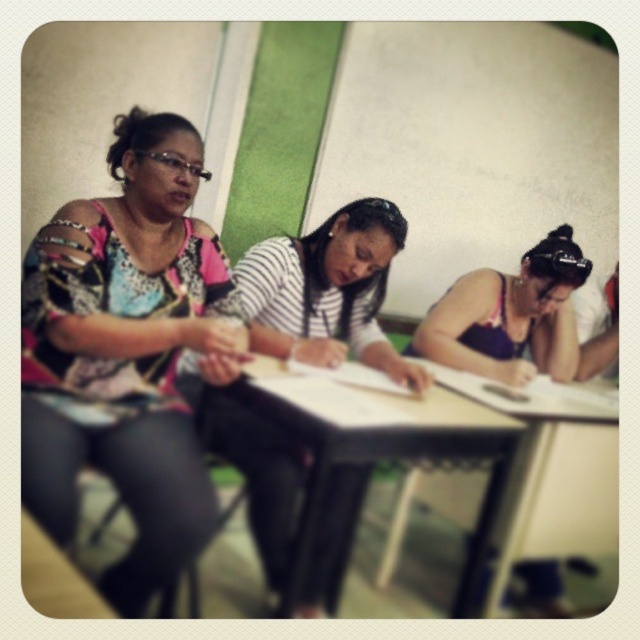
You are a photographer trying to capture the scene of the classroom. You want to ensure that both the multicolored printed blouse at left and the purple fabric hairband at center are clearly visible in your photo. Given their sizes, which object should you focus on first to ensure proper focus and clarity?

The multicolored printed blouse at left is larger in size than the purple fabric hairband at center. Therefore, you should focus on the multicolored printed blouse at left first to ensure proper focus and clarity since larger objects require more precise focusing to capture all details clearly.

You are a student in the classroom and want to look at both the point at position (192, 492) and the point at position (77, 598). Which point will appear closer to you when you look at them?

The point at position (192, 492) is further to the camera than the point at position (77, 598), so the point at position (77, 598) will appear closer to you.